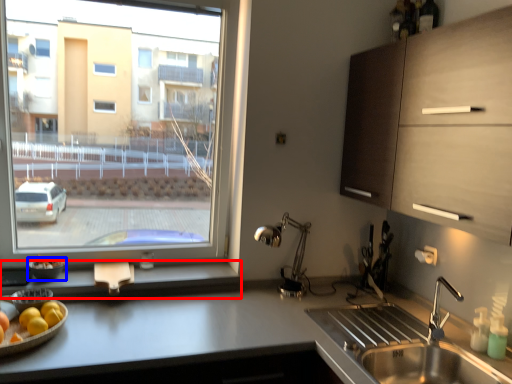
Question: Which point is further to the camera, window sill (highlighted by a red box) or glass bowl (highlighted by a blue box)?

Choices:
 (A) window sill
 (B) glass bowl

Answer: (B)